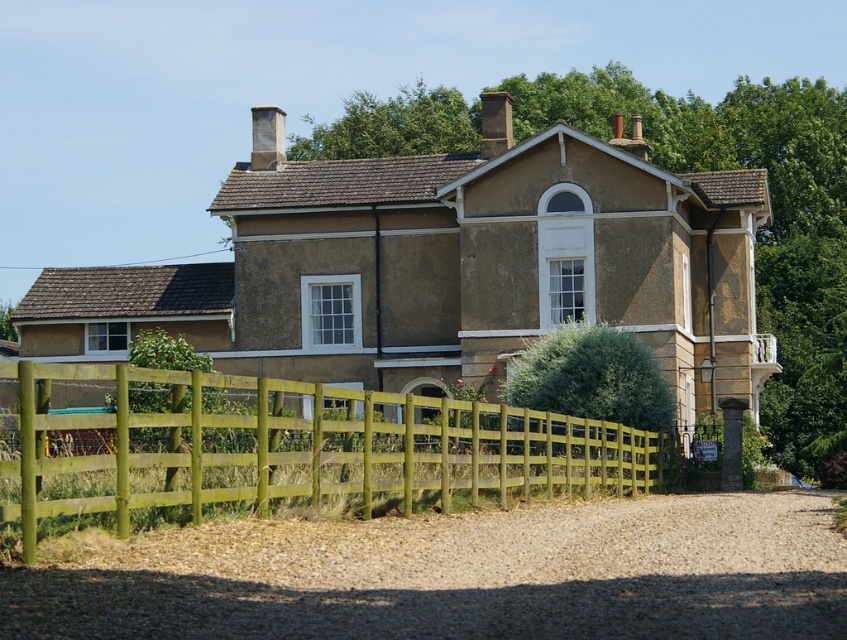
Question: Which point is closer to the camera?

Choices:
 (A) gravelly dirt driveway at lower center
 (B) green wooden fence at lower center

Answer: (A)

Question: Does gravelly dirt driveway at lower center appear on the right side of green wooden fence at lower center?

Choices:
 (A) no
 (B) yes

Answer: (B)

Question: Does gravelly dirt driveway at lower center appear on the right side of green wooden fence at lower center?

Choices:
 (A) no
 (B) yes

Answer: (B)

Question: In this image, where is gravelly dirt driveway at lower center located relative to green wooden fence at lower center?

Choices:
 (A) above
 (B) below

Answer: (B)

Question: Which point is farther to the camera?

Choices:
 (A) gravelly dirt driveway at lower center
 (B) green wooden fence at lower center

Answer: (B)